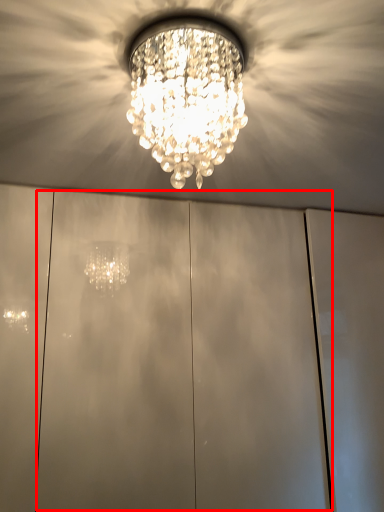
Question: From the image's perspective, what is the correct spatial positioning of glass door (annotated by the red box) in reference to lamp?

Choices:
 (A) above
 (B) below

Answer: (B)